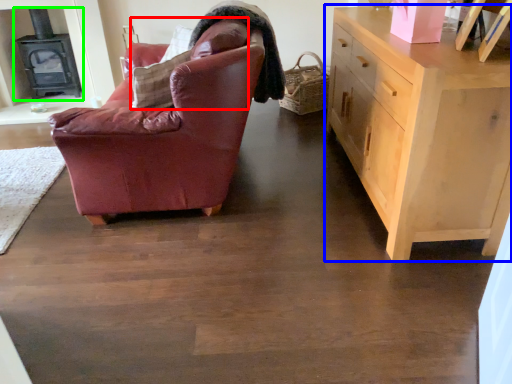
Question: Which object is the farthest from pillow (highlighted by a red box)? Choose among these: chest of drawers (highlighted by a blue box) or fireplace (highlighted by a green box).

Choices:
 (A) chest of drawers
 (B) fireplace

Answer: (B)